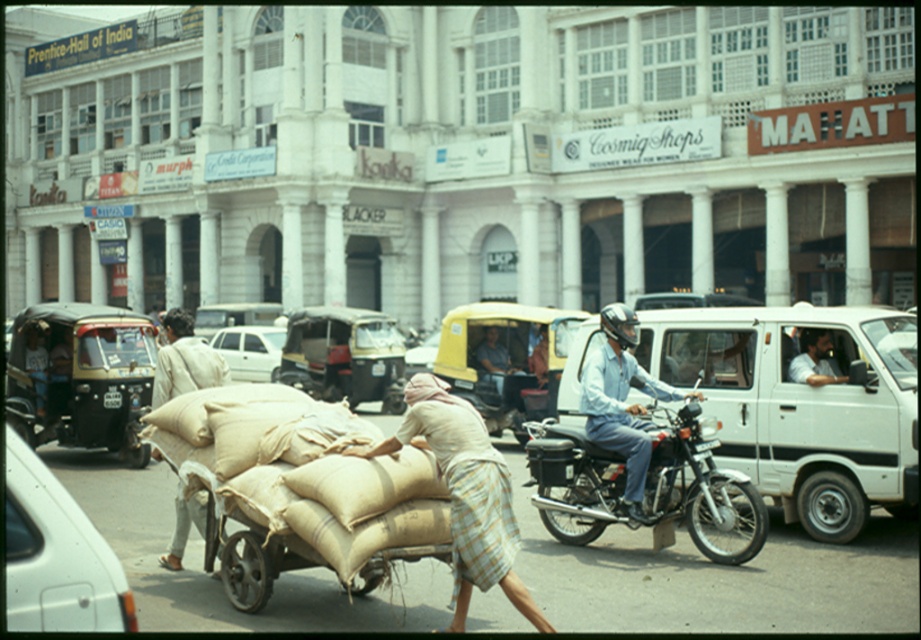
Question: Which object is the farthest from the white matte car at center?

Choices:
 (A) shiny black motorcycle at center
 (B) brown woven cart at center

Answer: (B)

Question: Is white matte van at center-right to the right of light blue denim shirt at center from the viewer's perspective?

Choices:
 (A) yes
 (B) no

Answer: (A)

Question: Can you confirm if white matte van at center-right is positioned to the left of white matte car at lower left?

Choices:
 (A) no
 (B) yes

Answer: (A)

Question: Observing the image, what is the correct spatial positioning of white matte van at center-right in reference to white matte car at center?

Choices:
 (A) left
 (B) right

Answer: (B)

Question: Which object is positioned farthest from the brown woven cart at center?

Choices:
 (A) metallic silver car at center
 (B) light blue denim shirt at center

Answer: (A)

Question: Estimate the real-world distances between objects in this image. Which object is farther from the light blue denim shirt at center?

Choices:
 (A) brown woven cart at center
 (B) white matte car at center

Answer: (B)